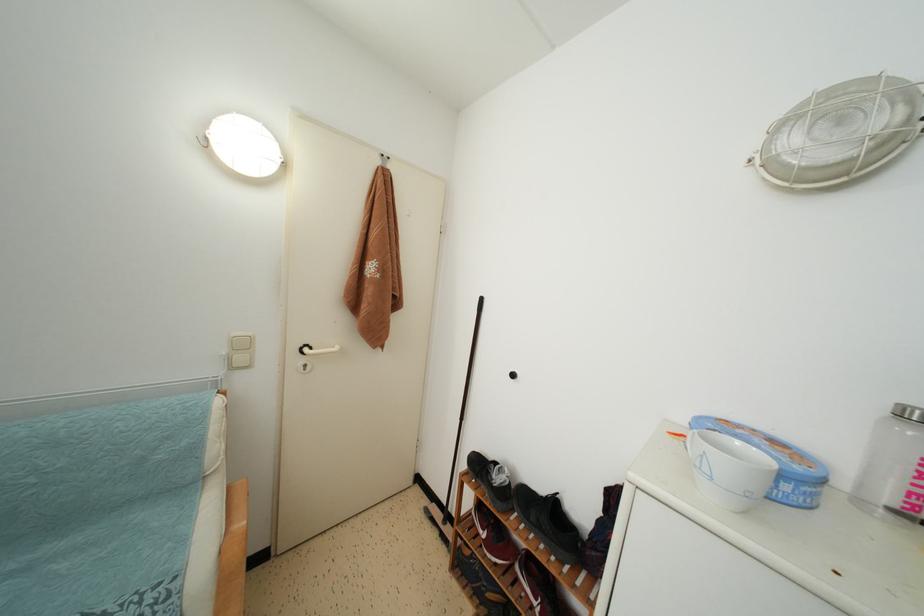
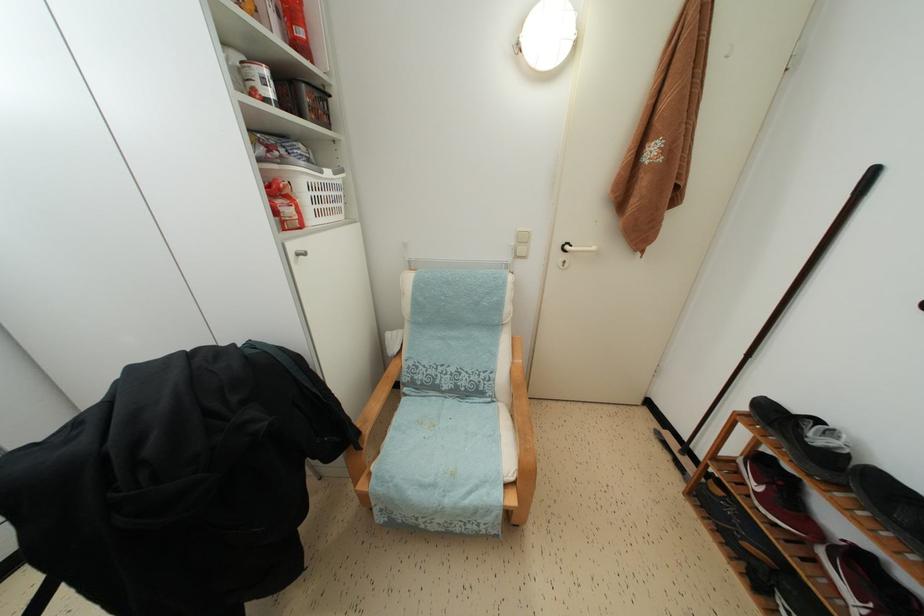
The point at (499, 469) is marked in the first image. Where is the corresponding point in the second image?

(821, 427)